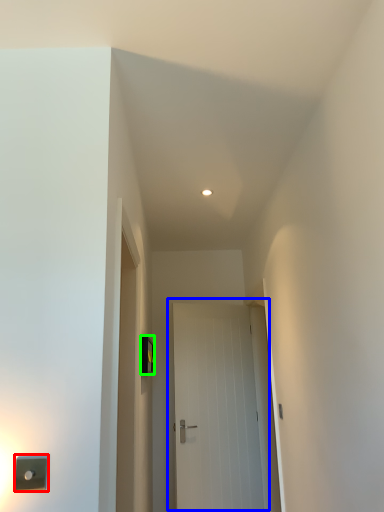
Question: Considering the real-world distances, which object is closest to light switch (highlighted by a red box)? door (highlighted by a blue box) or light switch (highlighted by a green box).

Choices:
 (A) door
 (B) light switch

Answer: (B)